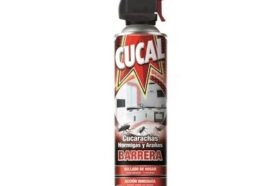
Locate an element on the screen. Image resolution: width=280 pixels, height=186 pixels. sink is located at coordinates (141, 111).